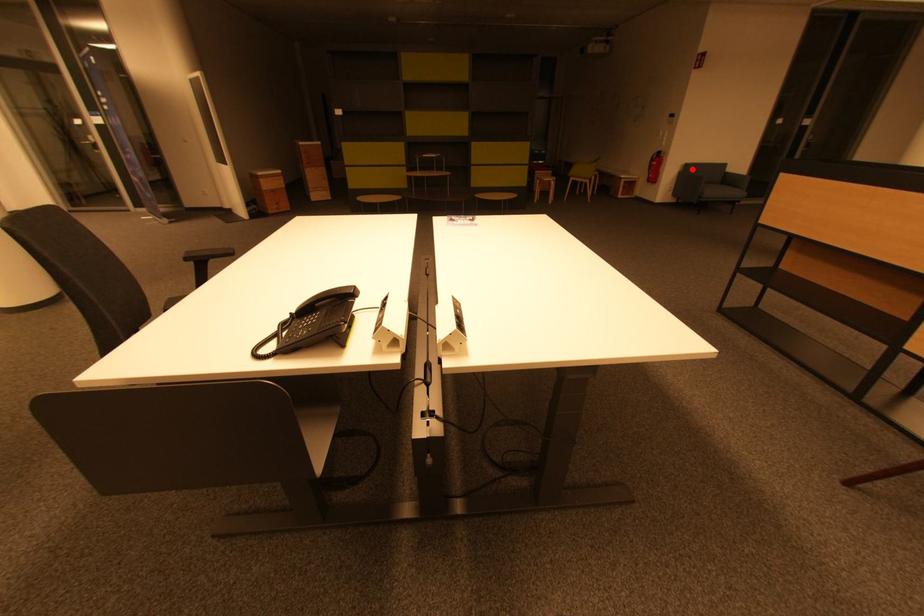
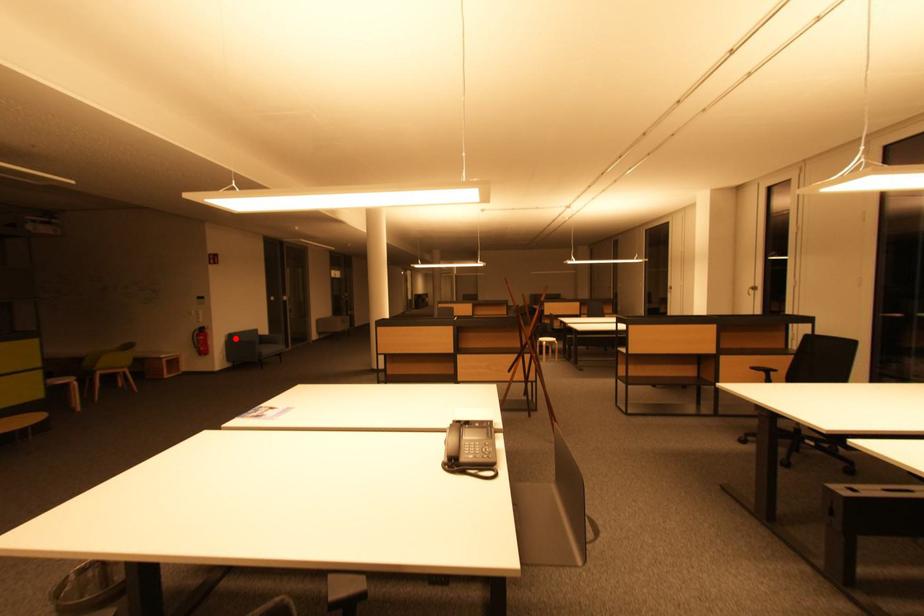
I am providing you with two images of the same scene from different viewpoints. A red point is marked on the first image and another point is marked on the second image. Does the point marked in image1 correspond to the same location as the one in image2?

Yes